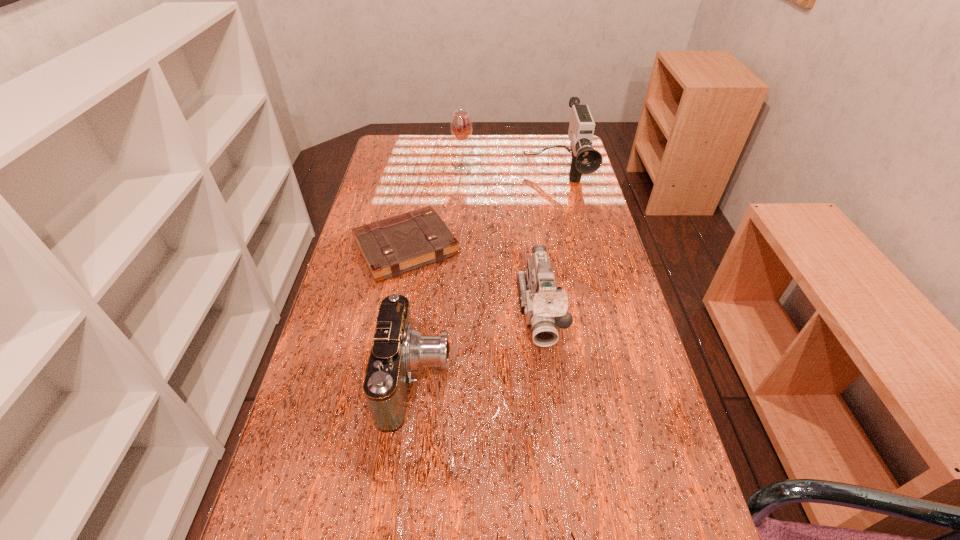
This screenshot has height=540, width=960. Find the location of `the tallest camcorder`. the tallest camcorder is located at coordinates (585, 159).

You are a GUI agent. You are given a task and a screenshot of the screen. Output one action in this format:
    pyautogui.click(x=<x>, y=<y>)
    Task: Click on the wineglass
    This screenshot has height=540, width=960.
    Given the screenshot: What is the action you would take?
    pyautogui.click(x=461, y=126)

This screenshot has height=540, width=960. Identify the location of the leftmost camcorder. (398, 349).

Find the location of `hardback book`. hardback book is located at coordinates (398, 244).

Where is `free region located 0.190m on the recording direction of the tallest camcorder`? free region located 0.190m on the recording direction of the tallest camcorder is located at coordinates (568, 242).

Locate an element on the screen. Image resolution: width=960 pixels, height=540 pixels. free space located 0.280m on the right of the wineglass is located at coordinates (550, 166).

Locate an element on the screen. This screenshot has width=960, height=540. free space located on the front-facing side of the leftmost camcorder is located at coordinates (604, 377).

The image size is (960, 540). Find the location of `vacant region located 0.320m on the back of the hardback book`. vacant region located 0.320m on the back of the hardback book is located at coordinates (421, 164).

Where is `camcorder that is positioned at the far edge`? Image resolution: width=960 pixels, height=540 pixels. camcorder that is positioned at the far edge is located at coordinates (585, 159).

The width and height of the screenshot is (960, 540). I want to click on wineglass at the far edge, so click(x=461, y=126).